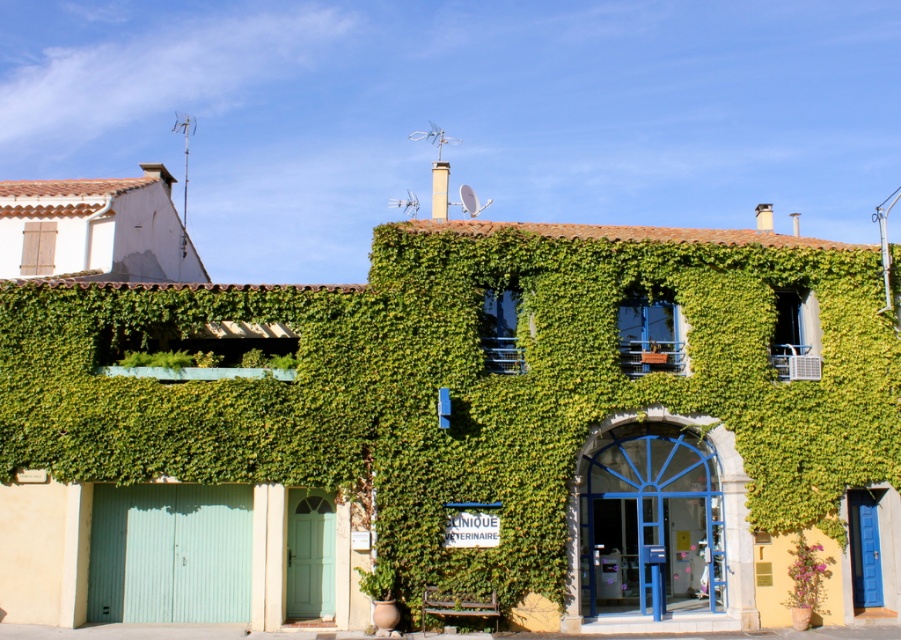
Question: Is blue painted wood at lower left wider than pink flower pot at lower right?

Choices:
 (A) no
 (B) yes

Answer: (B)

Question: Does teal matte/glossy garage door at lower left appear under pink flower pot at lower right?

Choices:
 (A) yes
 (B) no

Answer: (B)

Question: Which object appears farthest from the camera in this image?

Choices:
 (A) blue painted wood at lower left
 (B) teal matte/glossy garage door at lower left

Answer: (A)

Question: Which object is the farthest from the pink flower pot at lower right?

Choices:
 (A) blue painted wood at lower left
 (B) teal matte/glossy garage door at lower left

Answer: (B)

Question: Is blue painted wood at lower left bigger than teal matte/glossy garage door at lower left?

Choices:
 (A) yes
 (B) no

Answer: (A)

Question: Which is nearer to the pink flower pot at lower right?

Choices:
 (A) teal matte/glossy garage door at lower left
 (B) blue painted wood at lower left

Answer: (B)